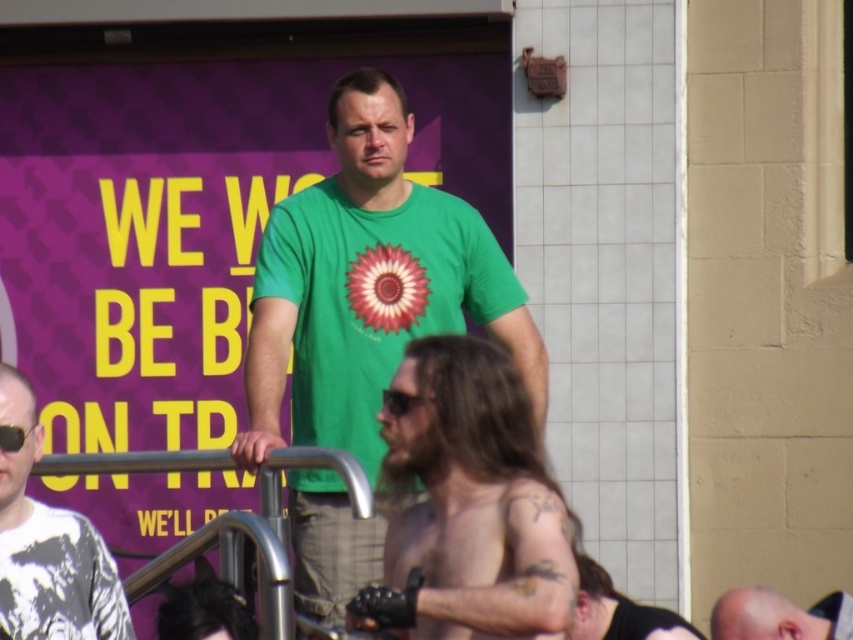
Question: Estimate the real-world distances between objects in this image. Which object is farther from the white printed t-shirt at center?

Choices:
 (A) bald head at center
 (B) green matte t-shirt at center
 (C) shiny leather glove at center
 (D) shiny black leather glove at lower center

Answer: (A)

Question: Which point is farther to the camera?

Choices:
 (A) shiny black leather glove at lower center
 (B) bald head at center
 (C) white printed t-shirt at center

Answer: (B)

Question: In this image, where is shiny leather glove at center located relative to shiny black leather glove at lower center?

Choices:
 (A) right
 (B) left

Answer: (B)

Question: Which object is farther from the camera taking this photo?

Choices:
 (A) shiny black leather glove at lower center
 (B) bald head at center

Answer: (B)

Question: Does shiny leather glove at center have a larger size compared to bald head at center?

Choices:
 (A) no
 (B) yes

Answer: (B)

Question: Does green matte t-shirt at center have a smaller size compared to bald head at center?

Choices:
 (A) yes
 (B) no

Answer: (A)